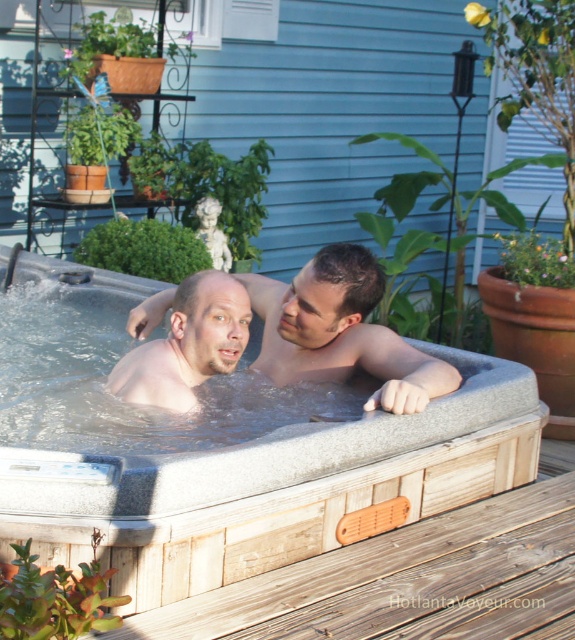
Question: Can you confirm if smooth skin man at center is positioned above matte skin at center?

Choices:
 (A) yes
 (B) no

Answer: (A)

Question: Which of the following is the farthest from the observer?

Choices:
 (A) matte skin at center
 (B) smooth skin man at center
 (C) gray plastic hot tub at center

Answer: (A)

Question: Can you confirm if wooden deck at lower right is positioned to the right of smooth skin man at center?

Choices:
 (A) no
 (B) yes

Answer: (B)

Question: Is gray plastic hot tub at center thinner than wooden deck at lower right?

Choices:
 (A) no
 (B) yes

Answer: (A)

Question: Which point is farther from the camera taking this photo?

Choices:
 (A) (508, 621)
 (B) (366, 500)
 (C) (225, 360)

Answer: (C)

Question: Which point is closer to the camera taking this photo?

Choices:
 (A) (460, 570)
 (B) (393, 356)
 (C) (78, 500)
 (D) (135, 358)

Answer: (C)